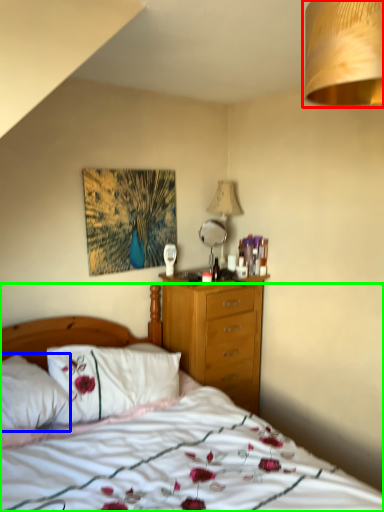
Question: Which object is the farthest from lamp (highlighted by a red box)? Choose among these: pillow (highlighted by a blue box) or bed (highlighted by a green box).

Choices:
 (A) pillow
 (B) bed

Answer: (A)